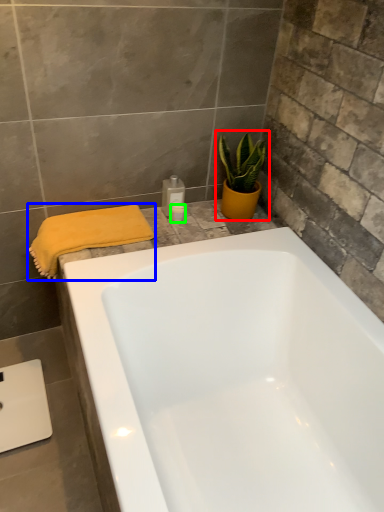
Question: Which object is the farthest from houseplant (highlighted by a red box)? Choose among these: bath towel (highlighted by a blue box) or toiletry (highlighted by a green box).

Choices:
 (A) bath towel
 (B) toiletry

Answer: (A)